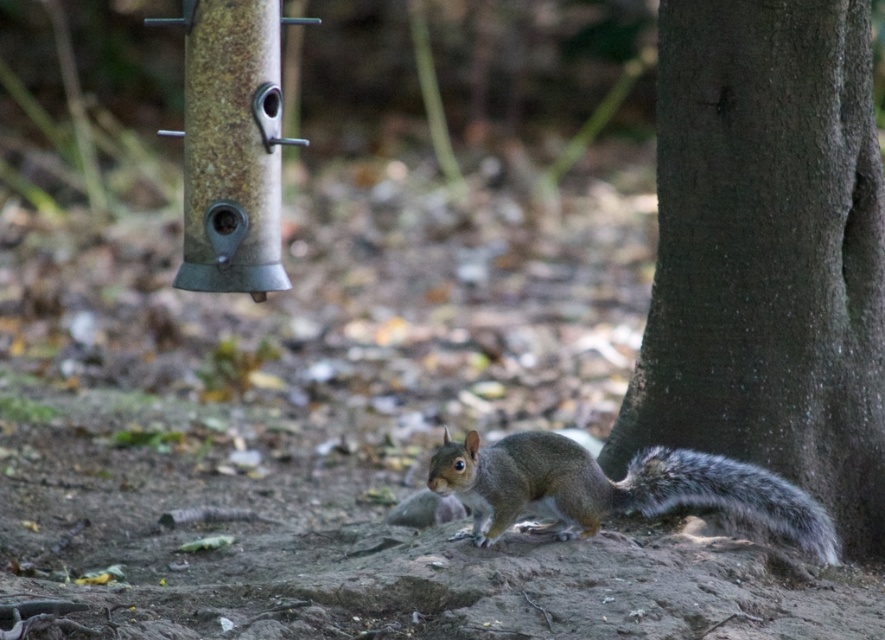
Question: Which of the following is the farthest from the observer?

Choices:
 (A) dark brown textured tree trunk at right
 (B) gray furry tail at lower right
 (C) gray fur squirrel at center

Answer: (A)

Question: Which of the following is the farthest from the observer?

Choices:
 (A) (804, 374)
 (B) (483, 456)
 (C) (729, 493)

Answer: (A)

Question: Does dark brown textured tree trunk at right come in front of gray furry tail at lower right?

Choices:
 (A) yes
 (B) no

Answer: (B)

Question: Does dark brown textured tree trunk at right have a smaller size compared to gray furry tail at lower right?

Choices:
 (A) yes
 (B) no

Answer: (B)

Question: Can you confirm if dark brown textured tree trunk at right is smaller than gray furry tail at lower right?

Choices:
 (A) yes
 (B) no

Answer: (B)

Question: Among these points, which one is nearest to the camera?

Choices:
 (A) (849, 88)
 (B) (739, 464)

Answer: (B)